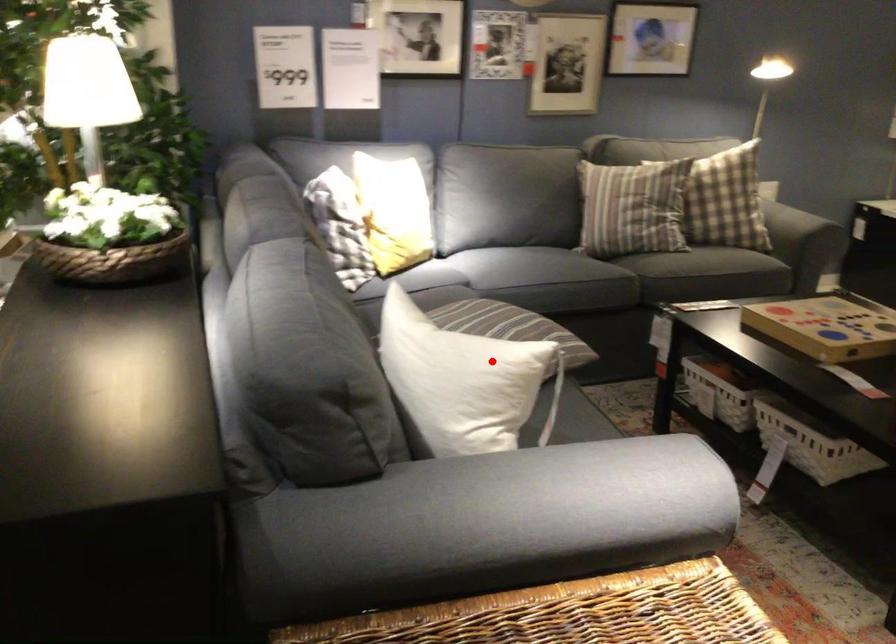
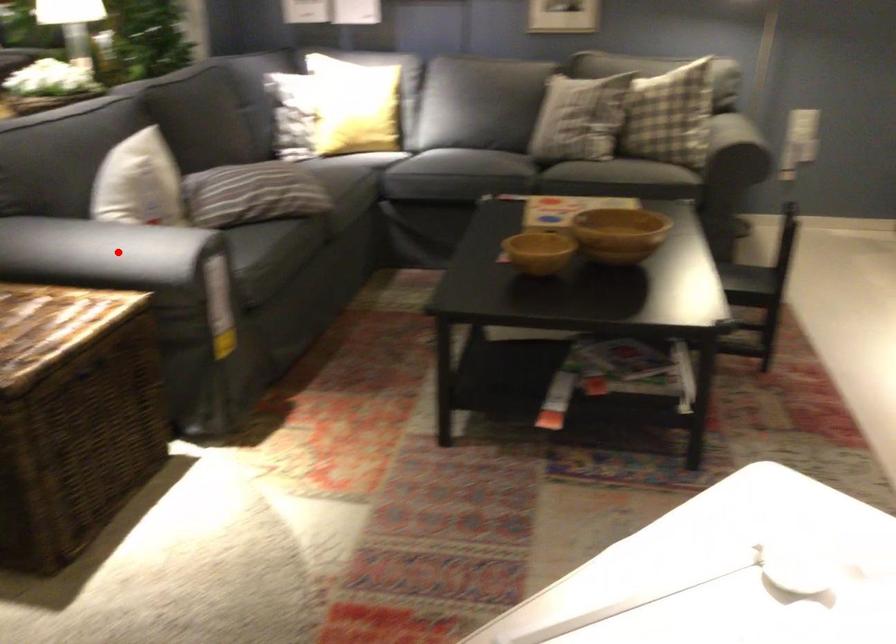
I am providing you with two images of the same scene from different viewpoints. A red point is marked on the first image and another point is marked on the second image. Is the marked point in image1 the same physical position as the marked point in image2?

No